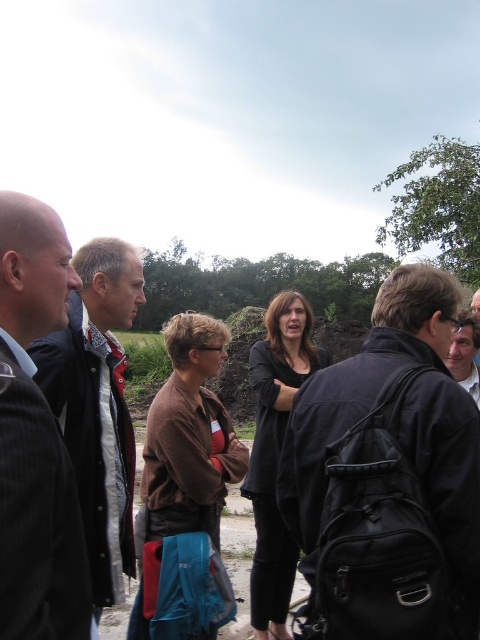
You are organizing a clothing donation drive and need to categorize items by size. You have two items to sort today. The first is the patterned fabric shirt at left and the second is the brown sweater at center. Which item is smaller in size?

The patterned fabric shirt at left is smaller in size compared to the brown sweater at center according to the description.

You are standing at the origin of the coordinate system in the image. There is a black leather backpack at center located at point (388, 476). If you walk straight ahead, will you reach the black leather backpack at center before reaching the edge of the image?

The black leather backpack at center is located at point (388, 476), which is within the image boundaries, so walking straight ahead from the origin would reach it before the edge.

You are a photographer setting up a shot of the group. You need to ensure that the dark suit at left and the patterned fabric shirt at left are both visible in the frame. Given their widths, which one might require you to adjust the camera angle to prevent it from being cut off?

The dark suit at left has a lesser width compared to the patterned fabric shirt at left, so the patterned fabric shirt at left is wider and might require adjusting the camera angle to prevent it from being cut off.